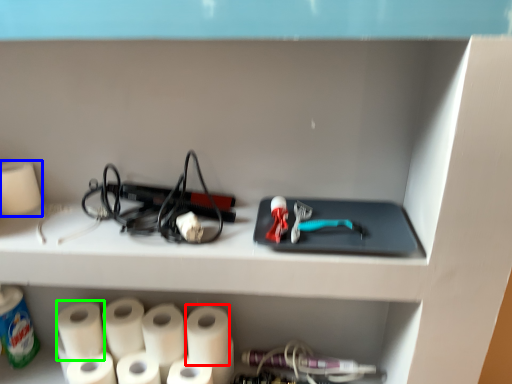
Question: Based on their relative distances, which object is farther from paper towel (highlighted by a red box)? Choose from paper towel (highlighted by a blue box) and paper towel (highlighted by a green box).

Choices:
 (A) paper towel
 (B) paper towel

Answer: (A)